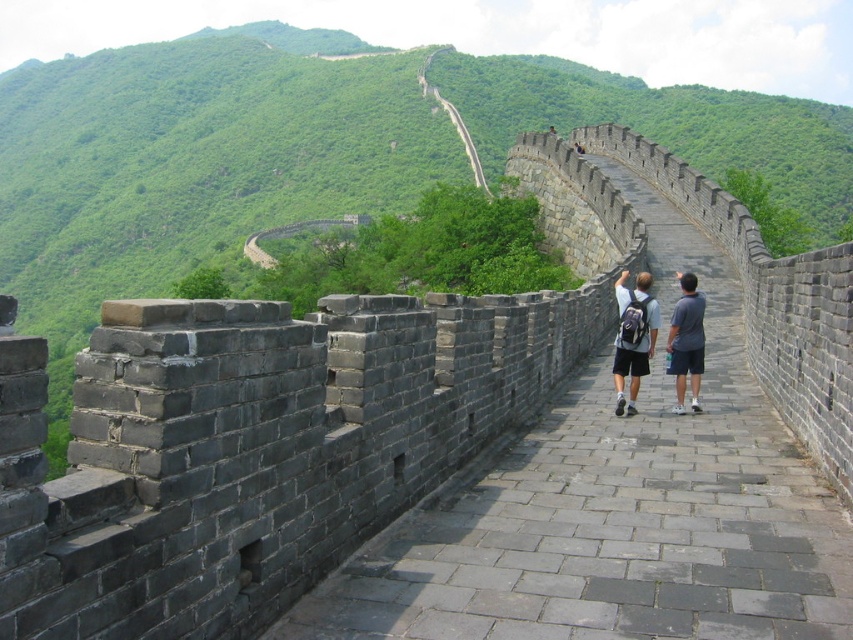
Is point (695, 342) less distant than point (624, 300)?

Yes.

In the scene shown: Is matte gray backpack at center to the left of gray backpack at center from the viewer's perspective?

No, matte gray backpack at center is not to the left of gray backpack at center.

What do you see at coordinates (633, 337) in the screenshot?
I see `matte gray backpack at center` at bounding box center [633, 337].

Locate an element on the screen. The image size is (853, 640). matte gray backpack at center is located at coordinates (633, 337).

Based on the photo, which of these two, gray backpack at center or gray fabric shorts at center-right, stands taller?

With more height is gray backpack at center.

Does gray backpack at center lie behind gray fabric shorts at center-right?

No, gray backpack at center is closer to the viewer.

Find the location of a particular element. gray backpack at center is located at coordinates (633, 340).

Is matte gray backpack at center positioned before gray fabric shorts at center-right?

Yes, matte gray backpack at center is in front of gray fabric shorts at center-right.

Can you confirm if matte gray backpack at center is positioned below gray fabric shorts at center-right?

Yes, matte gray backpack at center is below gray fabric shorts at center-right.

Which is in front, point (682, 410) or point (692, 304)?

Positioned in front is point (682, 410).

I want to click on matte gray backpack at center, so click(633, 337).